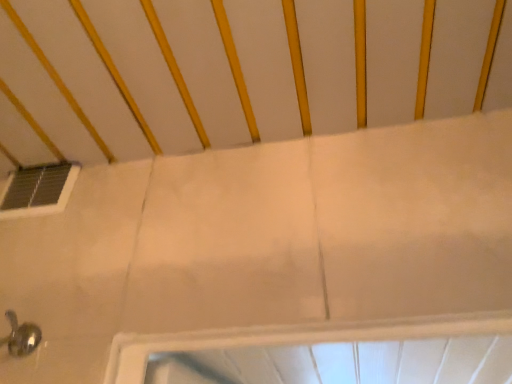
The height and width of the screenshot is (384, 512). What do you see at coordinates (237, 71) in the screenshot?
I see `white matte infant bed at upper center` at bounding box center [237, 71].

This screenshot has height=384, width=512. I want to click on white matte infant bed at upper center, so click(237, 71).

In order to face white matte infant bed at upper center, should I rotate leftwards or rightwards?

You should rotate left by 6.659 degrees.

The image size is (512, 384). What do you see at coordinates (39, 190) in the screenshot?
I see `transparent glass window at upper left` at bounding box center [39, 190].

Find the location of `transparent glass window at upper left`. transparent glass window at upper left is located at coordinates (39, 190).

I want to click on white matte infant bed at upper center, so click(237, 71).

Considering the positions of objects white matte infant bed at upper center and transparent glass window at upper left in the image provided, who is more to the left, white matte infant bed at upper center or transparent glass window at upper left?

transparent glass window at upper left is more to the left.

Which object is further away from the camera taking this photo, white matte infant bed at upper center or transparent glass window at upper left?

transparent glass window at upper left is further from the camera.

Which is closer to the camera, (136, 148) or (12, 211)?

Point (12, 211)

From the image's perspective, relative to transparent glass window at upper left, is white matte infant bed at upper center above or below?

From the image's perspective, white matte infant bed at upper center appears above transparent glass window at upper left.

Consider the image. From a real-world perspective, which object stands above the other?

In real-world perspective, white matte infant bed at upper center is above.

Based on the photo, considering the relative sizes of white matte infant bed at upper center and transparent glass window at upper left in the image provided, is white matte infant bed at upper center wider than transparent glass window at upper left?

Indeed, white matte infant bed at upper center has a greater width compared to transparent glass window at upper left.

Between white matte infant bed at upper center and transparent glass window at upper left, which one has more height?

Result: transparent glass window at upper left.

Between white matte infant bed at upper center and transparent glass window at upper left, which one has larger size?

white matte infant bed at upper center is bigger.

Is white matte infant bed at upper center surrounding transparent glass window at upper left?

Definitely not — transparent glass window at upper left is not inside white matte infant bed at upper center.

Is white matte infant bed at upper center not close to transparent glass window at upper left?

They are positioned close to each other.

Is white matte infant bed at upper center oriented away from transparent glass window at upper left?

No, white matte infant bed at upper center's orientation is not away from transparent glass window at upper left.

Based on the photo, can you tell me how much white matte infant bed at upper center and transparent glass window at upper left differ in facing direction?

They differ by 3.56 degrees in their facing directions.

The height and width of the screenshot is (384, 512). Find the location of `infant bed in front of the transparent glass window at upper left`. infant bed in front of the transparent glass window at upper left is located at coordinates (237, 71).

In the image, is transparent glass window at upper left on the left side or the right side of white matte infant bed at upper center?

In the image, transparent glass window at upper left appears on the left side of white matte infant bed at upper center.

Is transparent glass window at upper left positioned before white matte infant bed at upper center?

No.

Does point (45, 168) lie in front of point (322, 18)?

No, (45, 168) is further to viewer.

From the image's perspective, is transparent glass window at upper left above white matte infant bed at upper center?

Actually, transparent glass window at upper left appears below white matte infant bed at upper center in the image.

From a real-world perspective, is transparent glass window at upper left physically located above or below white matte infant bed at upper center?

Clearly, from a real-world perspective, transparent glass window at upper left is below white matte infant bed at upper center.

Does transparent glass window at upper left have a lesser width compared to white matte infant bed at upper center?

Correct, the width of transparent glass window at upper left is less than that of white matte infant bed at upper center.

Is transparent glass window at upper left taller or shorter than white matte infant bed at upper center?

Considering their sizes, transparent glass window at upper left has more height than white matte infant bed at upper center.

Who is smaller, transparent glass window at upper left or white matte infant bed at upper center?

transparent glass window at upper left is smaller.

Is transparent glass window at upper left located outside white matte infant bed at upper center?

Yes.

Consider the image. Is transparent glass window at upper left placed right next to white matte infant bed at upper center?

No, transparent glass window at upper left is not with white matte infant bed at upper center.

Is transparent glass window at upper left positioned with its back to white matte infant bed at upper center?

No.

Identify the location of infant bed on the right side of transparent glass window at upper left. (237, 71).

Where is `infant bed in front of the transparent glass window at upper left`? Image resolution: width=512 pixels, height=384 pixels. infant bed in front of the transparent glass window at upper left is located at coordinates (237, 71).

In the image, there is a white matte infant bed at upper center. In order to click on window below it (from the image's perspective) in this screenshot , I will do `click(39, 190)`.